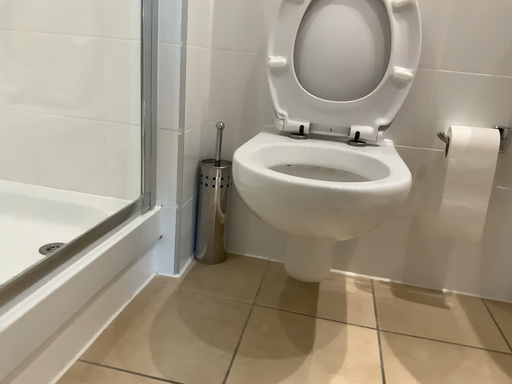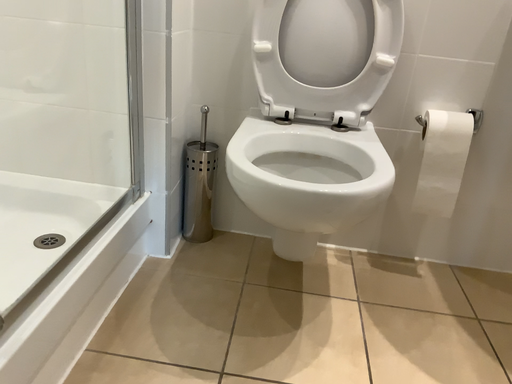
Question: Which way did the camera rotate in the video?

Choices:
 (A) rotated upward
 (B) rotated downward

Answer: (B)